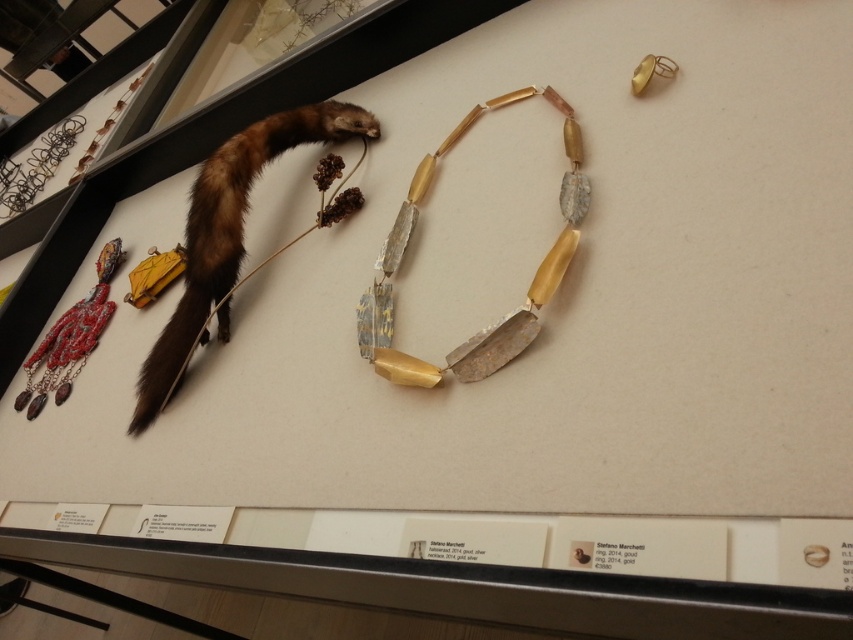
Question: Considering the relative positions of brown fur animal at upper left and gold textured necklace at center in the image provided, where is brown fur animal at upper left located with respect to gold textured necklace at center?

Choices:
 (A) below
 (B) above

Answer: (B)

Question: Among these points, which one is nearest to the camera?

Choices:
 (A) (409, 360)
 (B) (26, 388)
 (C) (212, 301)

Answer: (A)

Question: Which object is farther from the camera taking this photo?

Choices:
 (A) brown fur animal at upper left
 (B) reddish-brown leather necklace at lower left
 (C) gold textured necklace at center

Answer: (B)

Question: Which is farther from the gold textured necklace at center?

Choices:
 (A) brown fur animal at upper left
 (B) reddish-brown leather necklace at lower left

Answer: (B)

Question: Is brown fur animal at upper left closer to the viewer compared to gold textured necklace at center?

Choices:
 (A) no
 (B) yes

Answer: (A)

Question: Can you confirm if gold textured necklace at center is positioned above reddish-brown leather necklace at lower left?

Choices:
 (A) yes
 (B) no

Answer: (A)